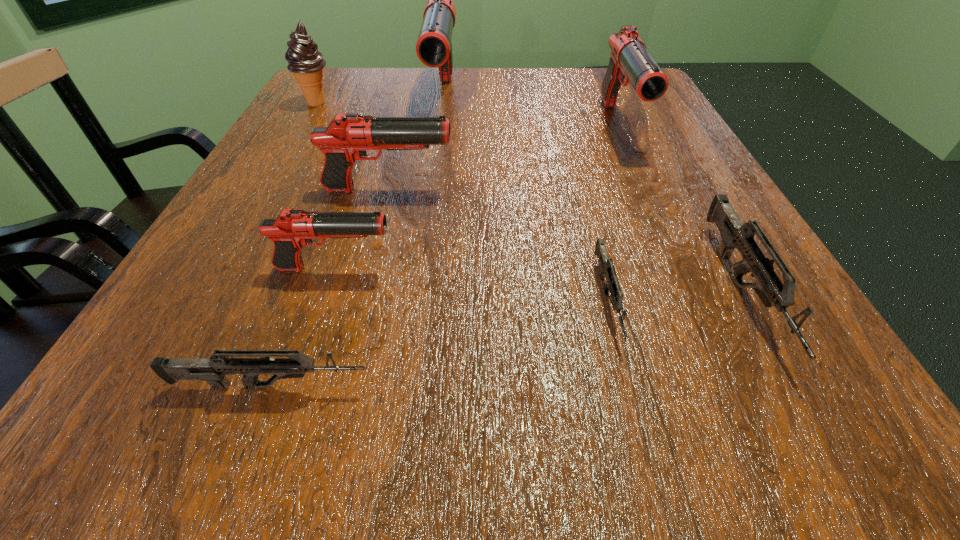
Locate an element on the screen. This screenshot has width=960, height=540. vacant space that's between the second grey gun from left to right and the sixth gun from left to right is located at coordinates (612, 213).

Image resolution: width=960 pixels, height=540 pixels. In order to click on free area in between the rightmost object and the tallest object in this screenshot , I will do `click(592, 195)`.

What are the coordinates of `vacant point located between the sixth tallest object and the leftmost grey gun` in the screenshot? It's located at (507, 339).

Find the location of `unoccupied area between the seventh tallest object and the third shortest gun`. unoccupied area between the seventh tallest object and the third shortest gun is located at coordinates (507, 339).

The width and height of the screenshot is (960, 540). What are the coordinates of `the third closest object to the second object from right to left` in the screenshot? It's located at (434, 47).

Identify which object is the second nearest to the second biggest black gun. Please provide its 2D coordinates. Your answer should be formatted as a tuple, i.e. [(x, y)], where the tuple contains the x and y coordinates of a point satisfying the conditions above.

[(607, 269)]

You are a GUI agent. You are given a task and a screenshot of the screen. Output one action in this format:
    pyautogui.click(x=<x>, y=<y>)
    Task: Click on the second closest gun to the second shortest gun
    This screenshot has width=960, height=540.
    Given the screenshot: What is the action you would take?
    pyautogui.click(x=607, y=269)

Identify which gun is the third nearest to the second smallest grey gun. Please provide its 2D coordinates. Your answer should be formatted as a tuple, i.e. [(x, y)], where the tuple contains the x and y coordinates of a point satisfying the conditions above.

[(346, 139)]

This screenshot has height=540, width=960. I want to click on black gun object that ranks as the second closest to the chocolate icecream, so click(346, 139).

The image size is (960, 540). What are the coordinates of `black gun that is the fourth closest to the shortest gun` in the screenshot? It's located at (434, 47).